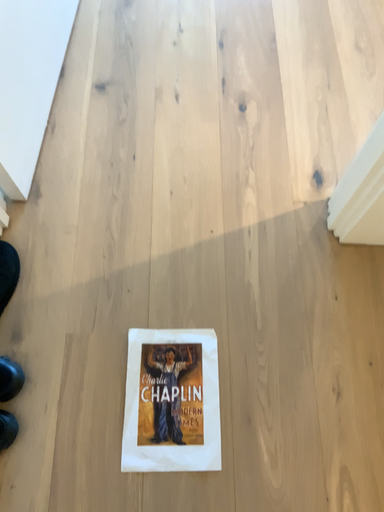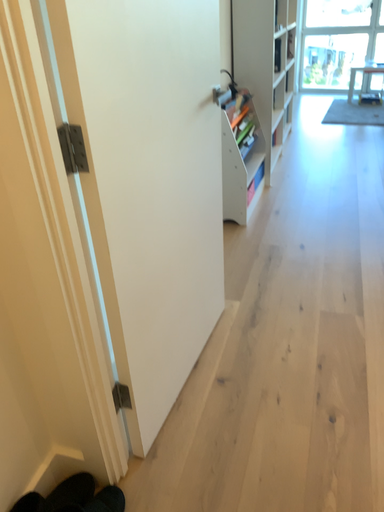
Question: How did the camera likely rotate when shooting the video?

Choices:
 (A) rotated upward
 (B) rotated downward

Answer: (A)